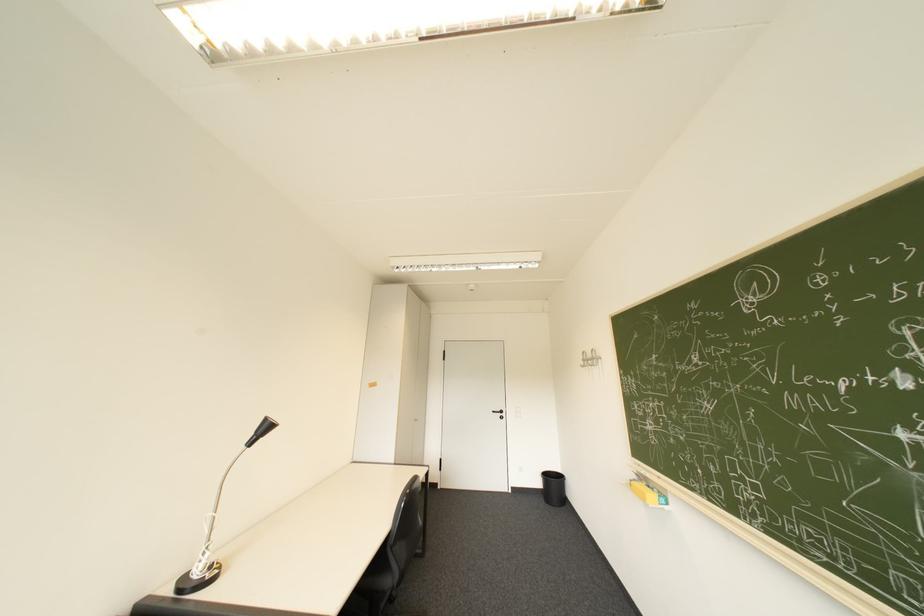
Where would you push the white light switch? Please return your answer as a coordinate pair (x, y).

(517, 411)